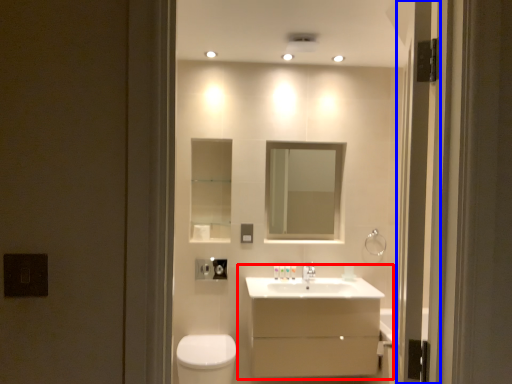
Question: Which object appears farthest to the camera in this image, bathroom cabinet (highlighted by a red box) or screen door (highlighted by a blue box)?

Choices:
 (A) bathroom cabinet
 (B) screen door

Answer: (A)